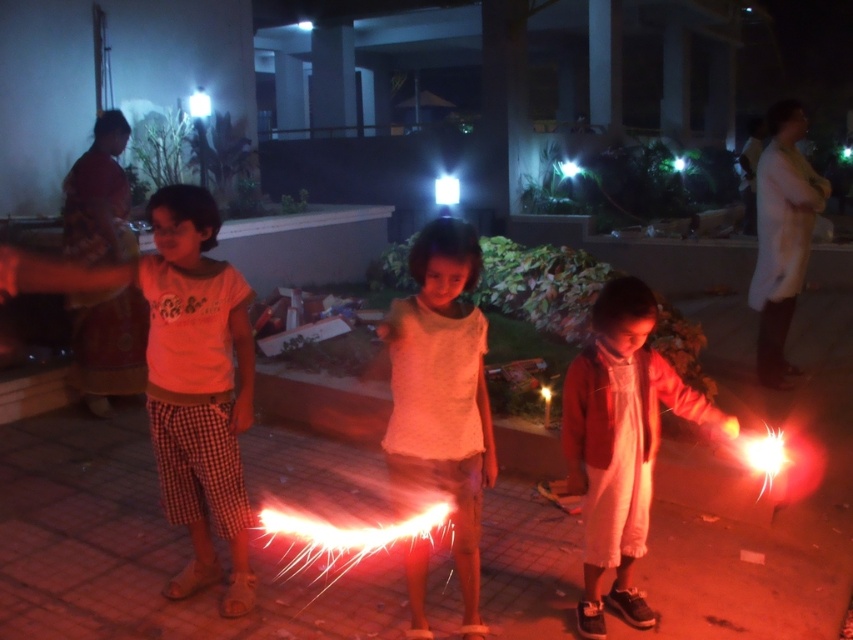
Question: Which of the following is the farthest from the observer?

Choices:
 (A) matte orange shirt at left
 (B) matte white dress at center

Answer: (B)

Question: Can you confirm if white cotton shirt at center is wider than matte white dress at center?

Choices:
 (A) no
 (B) yes

Answer: (A)

Question: Considering the relative positions of matte orange shirt at left and matte white dress at center in the image provided, where is matte orange shirt at left located with respect to matte white dress at center?

Choices:
 (A) above
 (B) below

Answer: (A)

Question: Among these points, which one is farthest from the camera?

Choices:
 (A) (444, 408)
 (B) (596, 547)
 (C) (196, 586)

Answer: (C)

Question: Is matte orange shirt at left bigger than matte white dress at center?

Choices:
 (A) no
 (B) yes

Answer: (B)

Question: Which object is the farthest from the white cotton shirt at center?

Choices:
 (A) matte orange shirt at left
 (B) matte white dress at center

Answer: (A)